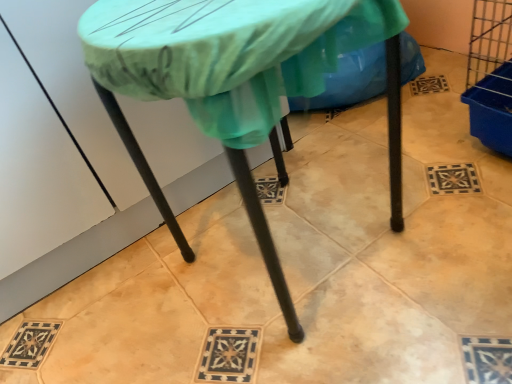
Where is `vacant space behind matte green tablecloth at center`? This screenshot has width=512, height=384. vacant space behind matte green tablecloth at center is located at coordinates (292, 162).